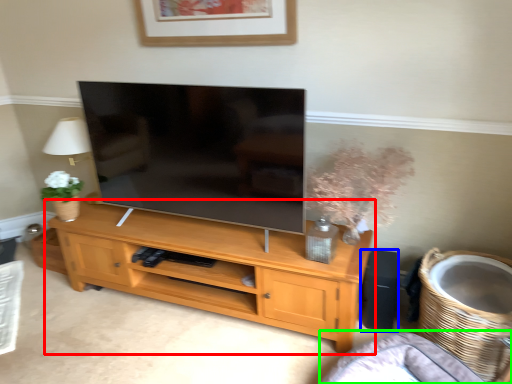
Question: Which object is positioned farthest from shelf (highlighted by a red box)? Select from speaker (highlighted by a blue box) and couch (highlighted by a green box).

Choices:
 (A) speaker
 (B) couch

Answer: (A)